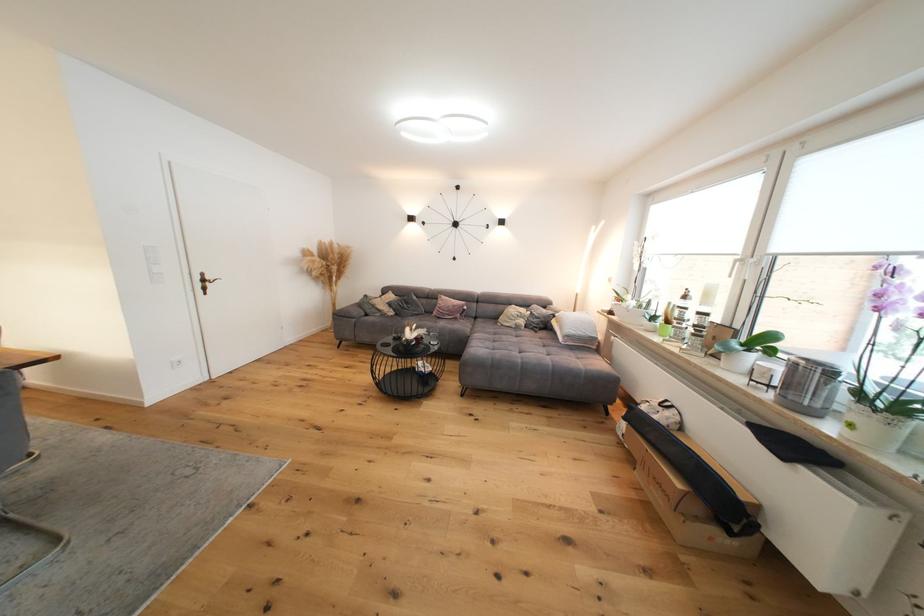
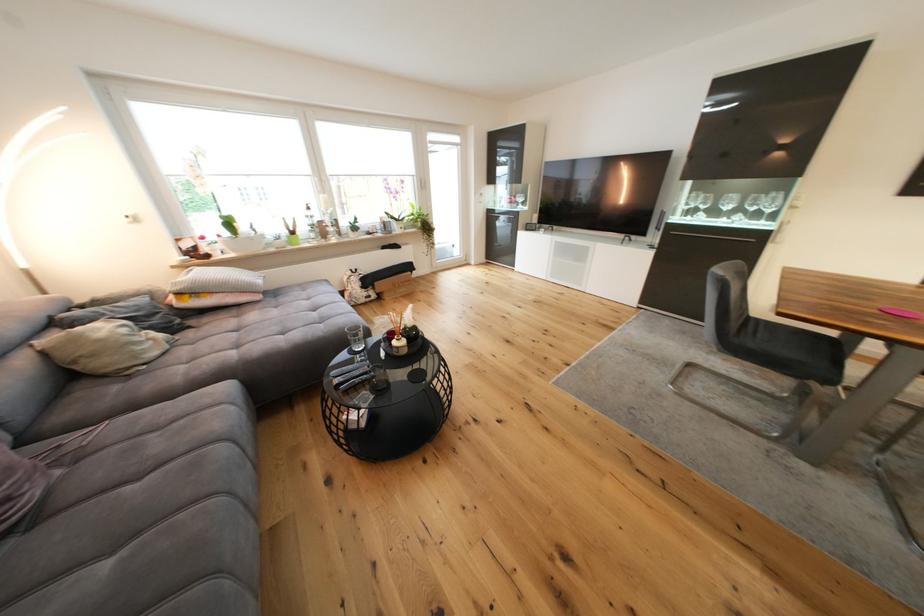
The point at (x=524, y=330) is marked in the first image. Where is the corresponding point in the second image?

(178, 345)